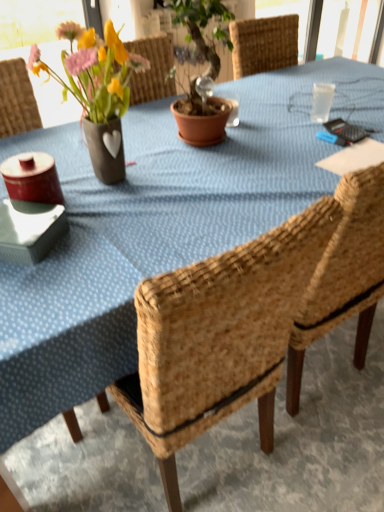
Where is `free area behind matte ceramic vase at upper left`? free area behind matte ceramic vase at upper left is located at coordinates (132, 140).